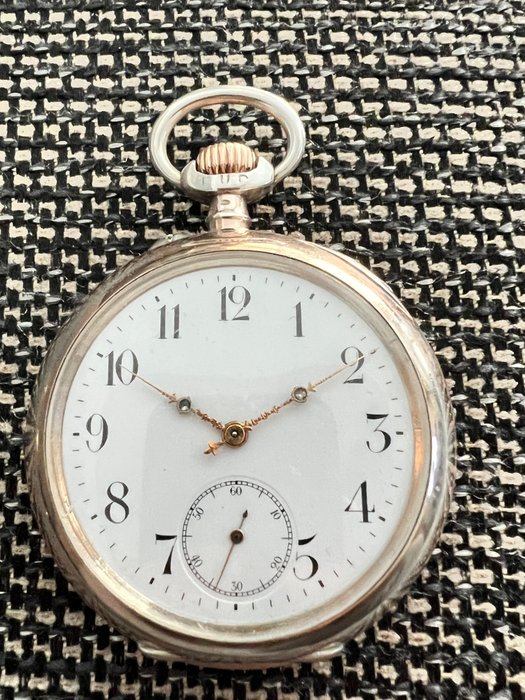
You are a GUI agent. You are given a task and a screenshot of the screen. Output one action in this format:
    pyautogui.click(x=<x>, y=<y>)
    Task: Click on the gold clock frame
    
    Given the screenshot: What is the action you would take?
    pyautogui.click(x=309, y=252)